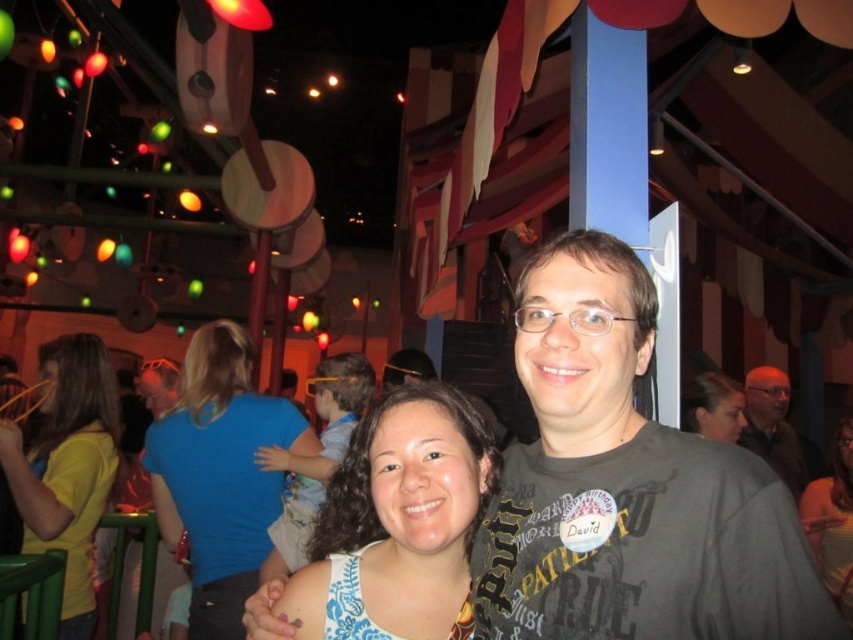
Between yellow matte shirt at left and white fabric shirt at center, which one has less height?

white fabric shirt at center is shorter.

Does yellow matte shirt at left have a lesser height compared to white fabric shirt at center?

No, yellow matte shirt at left is not shorter than white fabric shirt at center.

You are a GUI agent. You are given a task and a screenshot of the screen. Output one action in this format:
    pyautogui.click(x=<x>, y=<y>)
    Task: Click on the yellow matte shirt at left
    This screenshot has width=853, height=640.
    Given the screenshot: What is the action you would take?
    pyautogui.click(x=67, y=467)

In order to click on yellow matte shirt at left in this screenshot , I will do `click(67, 467)`.

Can you confirm if blue fabric shirt at center is positioned to the right of gray fabric shirt at center?

Incorrect, blue fabric shirt at center is not on the right side of gray fabric shirt at center.

Between point (224, 484) and point (780, 372), which one is positioned in front?

Point (224, 484) is more forward.

Where is `blue fabric shirt at center`? The width and height of the screenshot is (853, 640). blue fabric shirt at center is located at coordinates (219, 474).

The width and height of the screenshot is (853, 640). I want to click on blue fabric shirt at center, so click(x=219, y=474).

Consider the image. Is blue fabric shirt at center closer to camera compared to matte gray t-shirt at center?

No, it is behind matte gray t-shirt at center.

Which is in front, point (306, 429) or point (299, 563)?

Point (299, 563) is in front.

Locate an element on the screen. The height and width of the screenshot is (640, 853). blue fabric shirt at center is located at coordinates coord(219,474).